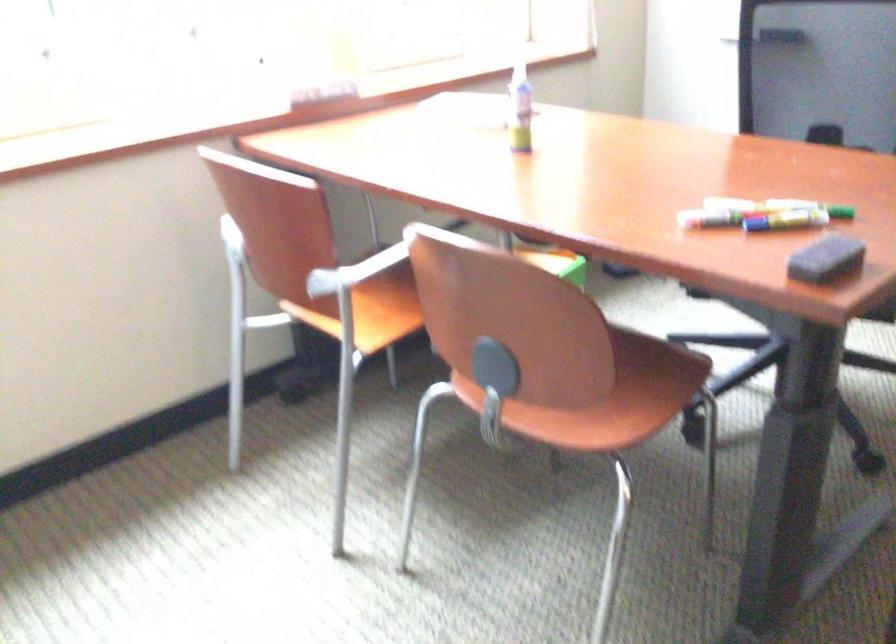
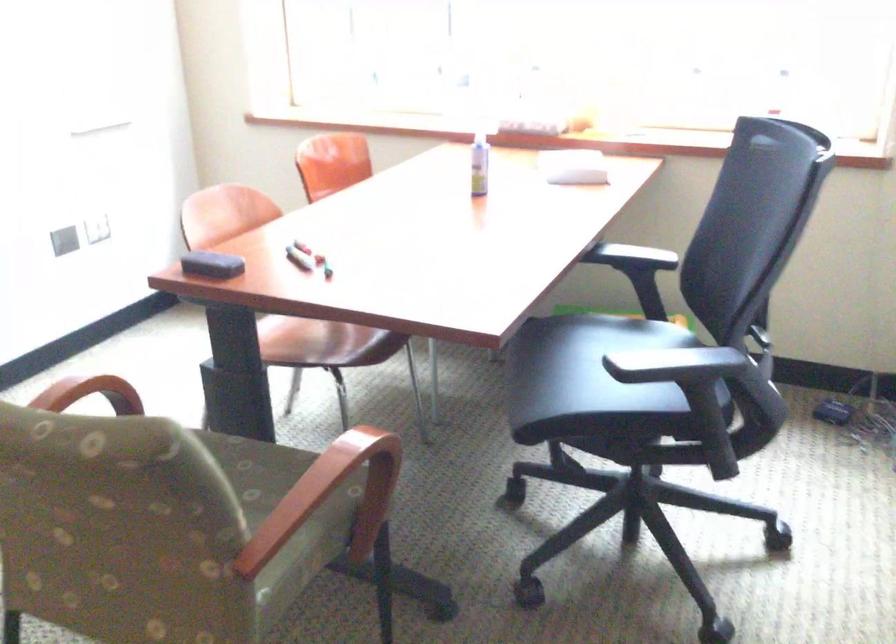
Find the pixel in the second image that matches point 521,113 in the first image.

(478, 164)